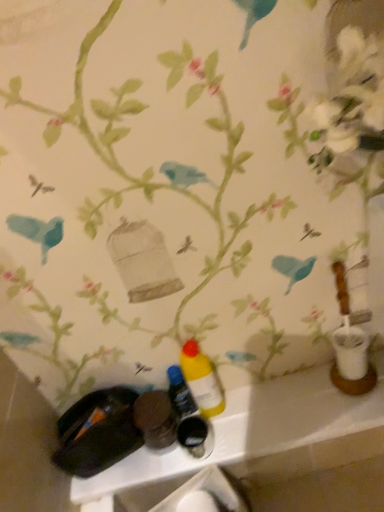
Question: Is yellow matte bottle at center, which is counted as the 1th bottle, starting from the left, located within matte plastic bottles at lower center?

Choices:
 (A) yes
 (B) no

Answer: (B)

Question: Is matte plastic bottles at lower center smaller than yellow matte bottle at center, which is counted as the 1th bottle, starting from the left?

Choices:
 (A) yes
 (B) no

Answer: (B)

Question: Considering the relative positions of matte plastic bottles at lower center and yellow matte bottle at center, marked as the second bottle in a right-to-left arrangement, in the image provided, is matte plastic bottles at lower center in front of yellow matte bottle at center, marked as the second bottle in a right-to-left arrangement,?

Choices:
 (A) yes
 (B) no

Answer: (A)

Question: Is matte plastic bottles at lower center placed right next to yellow matte bottle at center, marked as the second bottle in a right-to-left arrangement?

Choices:
 (A) no
 (B) yes

Answer: (A)

Question: Is matte plastic bottles at lower center not near yellow matte bottle at center, which is counted as the 1th bottle, starting from the left?

Choices:
 (A) yes
 (B) no

Answer: (B)

Question: Considering the relative sizes of matte plastic bottles at lower center and yellow matte bottle at center, which is counted as the 1th bottle, starting from the left, in the image provided, is matte plastic bottles at lower center thinner than yellow matte bottle at center, which is counted as the 1th bottle, starting from the left,?

Choices:
 (A) no
 (B) yes

Answer: (A)

Question: Considering the relative positions of yellow matte bottle at center, which ranks as the 1th bottle in right-to-left order, and yellow matte bottle at center, marked as the second bottle in a right-to-left arrangement, in the image provided, is yellow matte bottle at center, which ranks as the 1th bottle in right-to-left order, to the left of yellow matte bottle at center, marked as the second bottle in a right-to-left arrangement, from the viewer's perspective?

Choices:
 (A) yes
 (B) no

Answer: (B)

Question: Is yellow matte bottle at center, which is counted as the 2th bottle, starting from the left, at the right side of yellow matte bottle at center, which is counted as the 1th bottle, starting from the left?

Choices:
 (A) yes
 (B) no

Answer: (A)

Question: Can we say yellow matte bottle at center, which is counted as the 2th bottle, starting from the left, lies outside yellow matte bottle at center, marked as the second bottle in a right-to-left arrangement?

Choices:
 (A) no
 (B) yes

Answer: (B)

Question: From a real-world perspective, is yellow matte bottle at center, which ranks as the 1th bottle in right-to-left order, on top of yellow matte bottle at center, marked as the second bottle in a right-to-left arrangement?

Choices:
 (A) yes
 (B) no

Answer: (A)

Question: Does yellow matte bottle at center, which ranks as the 1th bottle in right-to-left order, lie in front of yellow matte bottle at center, marked as the second bottle in a right-to-left arrangement?

Choices:
 (A) yes
 (B) no

Answer: (A)

Question: Is yellow matte bottle at center, which is counted as the 2th bottle, starting from the left, looking in the opposite direction of yellow matte bottle at center, which is counted as the 1th bottle, starting from the left?

Choices:
 (A) yes
 (B) no

Answer: (B)

Question: Is yellow matte bottle at center, which is counted as the 1th bottle, starting from the left, at the right side of matte plastic bottles at lower center?

Choices:
 (A) yes
 (B) no

Answer: (B)